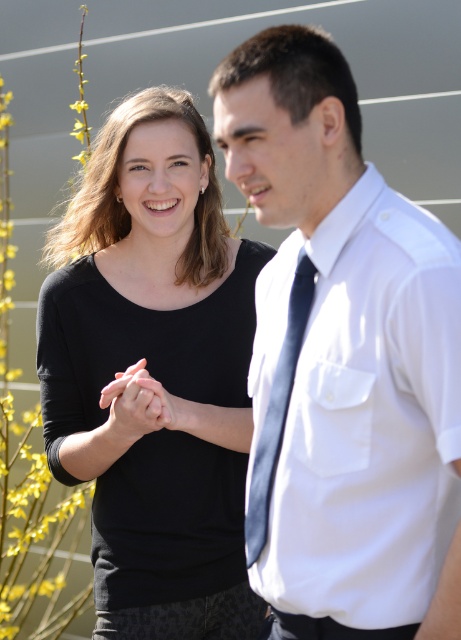
Which of these two, white smooth shirt at right or matte black hands at center, stands taller?

white smooth shirt at right

Does white smooth shirt at right appear under matte black hands at center?

Incorrect, white smooth shirt at right is not positioned below matte black hands at center.

The image size is (461, 640). What do you see at coordinates (362, 413) in the screenshot?
I see `white smooth shirt at right` at bounding box center [362, 413].

The width and height of the screenshot is (461, 640). Identify the location of white smooth shirt at right. (362, 413).

Does black matte shirt at center have a smaller size compared to white smooth shirt at right?

Actually, black matte shirt at center might be larger than white smooth shirt at right.

How far apart are black matte shirt at center and white smooth shirt at right?

24.80 inches

Between point (170, 147) and point (419, 541), which one is positioned in front?

Positioned in front is point (419, 541).

Locate an element on the screen. This screenshot has width=461, height=640. black matte shirt at center is located at coordinates (154, 372).

Does black matte shirt at center appear over matte black hands at center?

Correct, black matte shirt at center is located above matte black hands at center.

Who is lower down, black matte shirt at center or matte black hands at center?

matte black hands at center is below.

Who is more distant from viewer, (100, 460) or (147, 410)?

Result: The point (100, 460) is behind.

Where is `black matte shirt at center`? black matte shirt at center is located at coordinates pos(154,372).